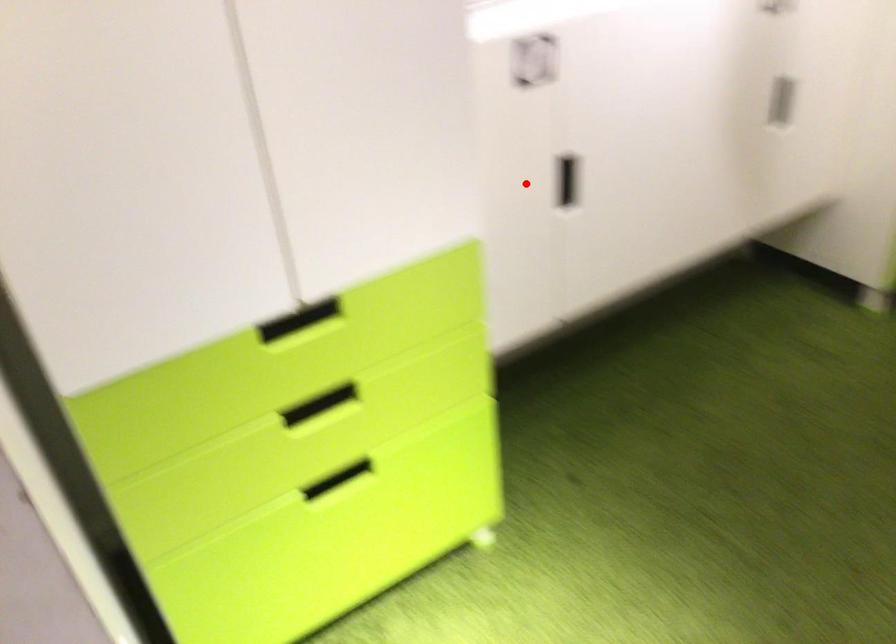
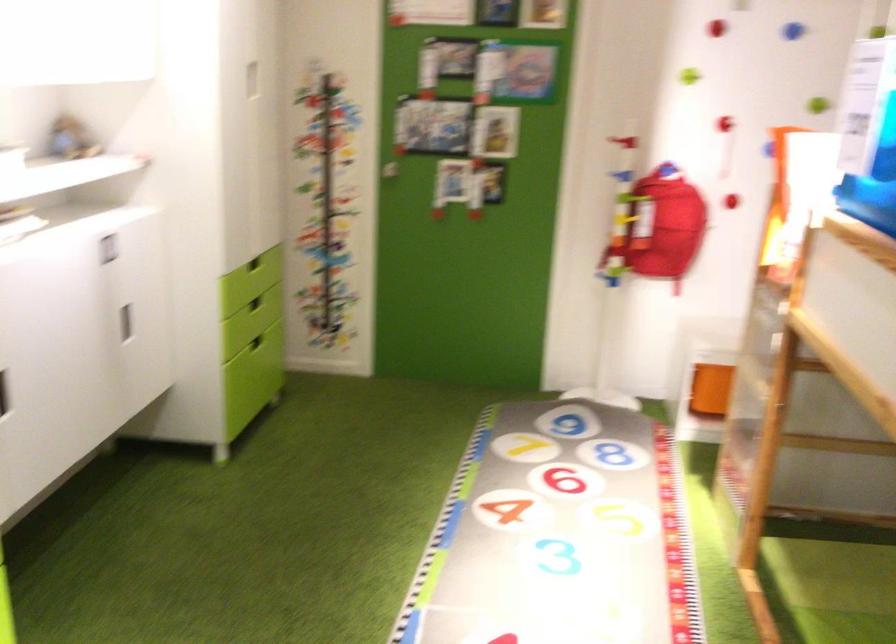
Question: I am providing you with two images of the same scene from different viewpoints. Image1 has a red point marked. In image2, the corresponding 3D location appears at what relative position? Reply with the corresponding letter.

Choices:
 (A) Closer
 (B) Farther

Answer: (B)